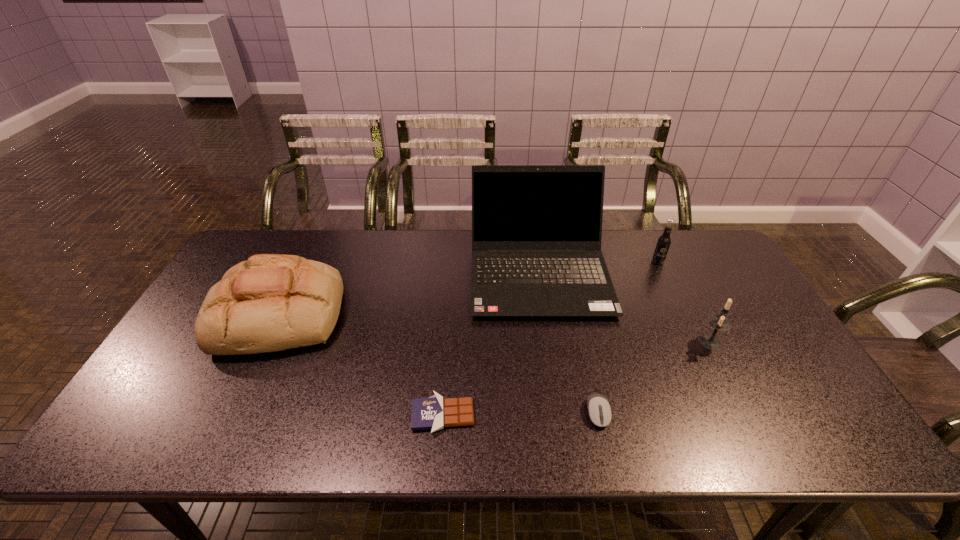
The image size is (960, 540). What are the coordinates of `the tallest object` in the screenshot? It's located at (536, 229).

Image resolution: width=960 pixels, height=540 pixels. Identify the location of bread. [x=271, y=302].

This screenshot has width=960, height=540. In order to click on root beer in this screenshot , I will do `click(663, 243)`.

I want to click on candle holder, so [719, 322].

The image size is (960, 540). Identify the location of the second shortest object. (599, 410).

At what (x,y) coordinates should I click in order to perform the action: click on chocolate bar. Please return your answer as a coordinate pair (x, y). The height and width of the screenshot is (540, 960). Looking at the image, I should click on (435, 413).

Image resolution: width=960 pixels, height=540 pixels. I want to click on free space located on the screen of the laptop computer, so click(555, 376).

You are a GUI agent. You are given a task and a screenshot of the screen. Output one action in this format:
    pyautogui.click(x=<x>, y=<y>)
    Task: Click on the vacant area located on the back of the leftmost object
    Image resolution: width=960 pixels, height=540 pixels.
    Given the screenshot: What is the action you would take?
    pyautogui.click(x=308, y=255)

Locate an element on the screen. The height and width of the screenshot is (540, 960). vacant area located 0.400m on the label of the root beer is located at coordinates (707, 362).

Where is `free location located 0.340m on the left of the candle holder`? free location located 0.340m on the left of the candle holder is located at coordinates (572, 342).